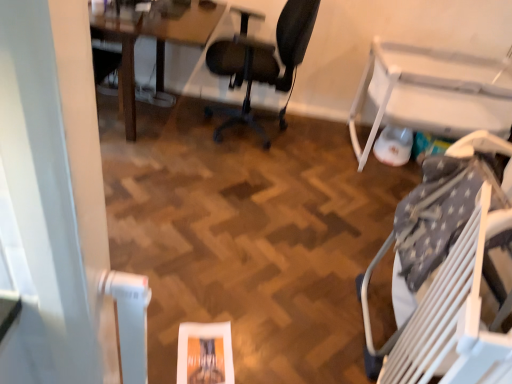
Question: Should I look upward or downward to see wooden table at upper left, placed as the first table when sorted from left to right?

Choices:
 (A) up
 (B) down

Answer: (A)

Question: Should I look upward or downward to see black mesh office chair at center, acting as the second chair starting from the right?

Choices:
 (A) up
 (B) down

Answer: (A)

Question: From the image's perspective, is white plastic table at right, the 2th table when ordered from left to right, beneath white plastic chair at lower right, the 1th chair positioned from the front?

Choices:
 (A) yes
 (B) no

Answer: (B)

Question: Is white plastic table at right, the 2th table when ordered from left to right, behind white plastic chair at lower right, the 1th chair from the right?

Choices:
 (A) no
 (B) yes

Answer: (B)

Question: From the image's perspective, does white plastic table at right, the 2th table when ordered from left to right, appear higher than white plastic chair at lower right, the second chair when ordered from top to bottom?

Choices:
 (A) yes
 (B) no

Answer: (A)

Question: Considering the relative positions of white plastic table at right, which appears as the 1th table when viewed from the right, and white plastic chair at lower right, the 1th chair positioned from the front, in the image provided, is white plastic table at right, which appears as the 1th table when viewed from the right, to the right of white plastic chair at lower right, the 1th chair positioned from the front, from the viewer's perspective?

Choices:
 (A) yes
 (B) no

Answer: (A)

Question: Considering the relative sizes of white plastic table at right, the 2th table when ordered from left to right, and white plastic chair at lower right, the 1th chair from the right, in the image provided, is white plastic table at right, the 2th table when ordered from left to right, taller than white plastic chair at lower right, the 1th chair from the right,?

Choices:
 (A) yes
 (B) no

Answer: (B)

Question: Does white plastic table at right, the 2th table when ordered from left to right, have a greater width compared to white plastic chair at lower right, which is the second chair in back-to-front order?

Choices:
 (A) yes
 (B) no

Answer: (A)

Question: Does white plastic chair at lower right, which is the second chair in back-to-front order, have a lesser width compared to wooden table at upper left, which appears as the second table when viewed from the right?

Choices:
 (A) yes
 (B) no

Answer: (A)

Question: Considering the relative sizes of white plastic chair at lower right, which is the second chair in back-to-front order, and wooden table at upper left, which appears as the second table when viewed from the right, in the image provided, is white plastic chair at lower right, which is the second chair in back-to-front order, taller than wooden table at upper left, which appears as the second table when viewed from the right,?

Choices:
 (A) yes
 (B) no

Answer: (A)

Question: Does white plastic chair at lower right, the 1th chair from the right, have a greater width compared to wooden table at upper left, placed as the first table when sorted from left to right?

Choices:
 (A) yes
 (B) no

Answer: (B)

Question: From the image's perspective, is white plastic chair at lower right, the 1th chair from the right, on top of wooden table at upper left, placed as the first table when sorted from left to right?

Choices:
 (A) yes
 (B) no

Answer: (B)

Question: Is white plastic chair at lower right, the 1th chair positioned from the front, positioned behind wooden table at upper left, which appears as the second table when viewed from the right?

Choices:
 (A) no
 (B) yes

Answer: (A)

Question: Is white plastic chair at lower right, the 1th chair when ordered from bottom to top, positioned in front of wooden table at upper left, placed as the first table when sorted from left to right?

Choices:
 (A) no
 (B) yes

Answer: (B)

Question: Is wooden table at upper left, which appears as the second table when viewed from the right, thinner than black mesh office chair at center, the second chair when ordered from bottom to top?

Choices:
 (A) yes
 (B) no

Answer: (B)